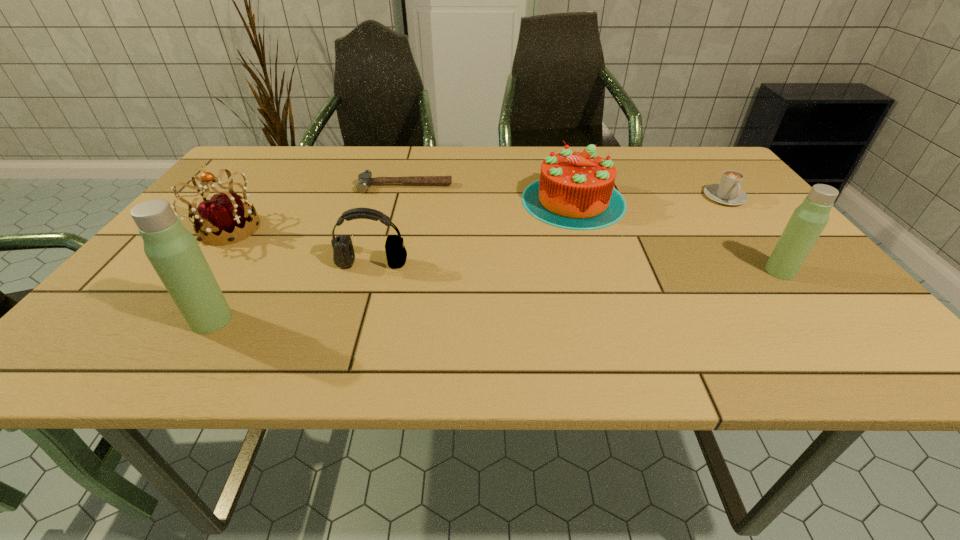
The image size is (960, 540). I want to click on thermos bottle positioned at the right edge, so click(x=809, y=219).

This screenshot has width=960, height=540. Identify the location of cappuccino that is at the right edge. (728, 192).

Image resolution: width=960 pixels, height=540 pixels. I want to click on vacant space at the far edge of the desktop, so click(675, 177).

Where is `free location at the near edge`? This screenshot has width=960, height=540. free location at the near edge is located at coordinates (546, 325).

Where is `vacant space at the left edge of the desktop`? The width and height of the screenshot is (960, 540). vacant space at the left edge of the desktop is located at coordinates (239, 187).

Where is `free space at the right edge`? free space at the right edge is located at coordinates (718, 221).

In order to click on vacant space at the far left corner in this screenshot , I will do `click(255, 169)`.

At what (x,y) coordinates should I click in order to perform the action: click on free location at the far right corner of the desktop. Please return your answer as a coordinate pair (x, y). Looking at the image, I should click on (684, 170).

At what (x,y) coordinates should I click in order to perform the action: click on vacant area at the near right corner. Please return your answer as a coordinate pair (x, y). The image size is (960, 540). Looking at the image, I should click on pyautogui.click(x=814, y=307).

At what (x,y) coordinates should I click in order to perform the action: click on vacant area that lies between the third object from right to left and the cappuccino. Please return your answer as a coordinate pair (x, y). This screenshot has height=540, width=960. Looking at the image, I should click on (649, 199).